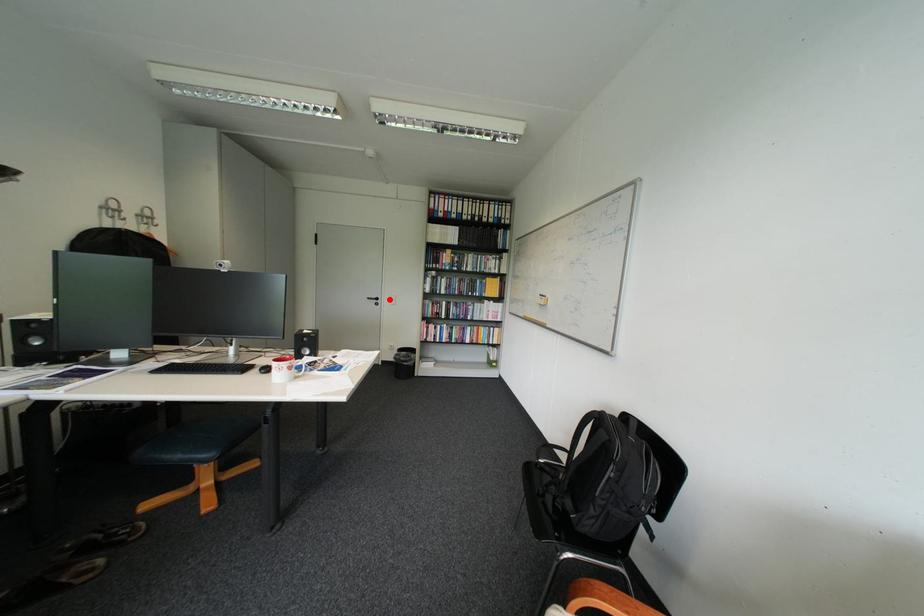
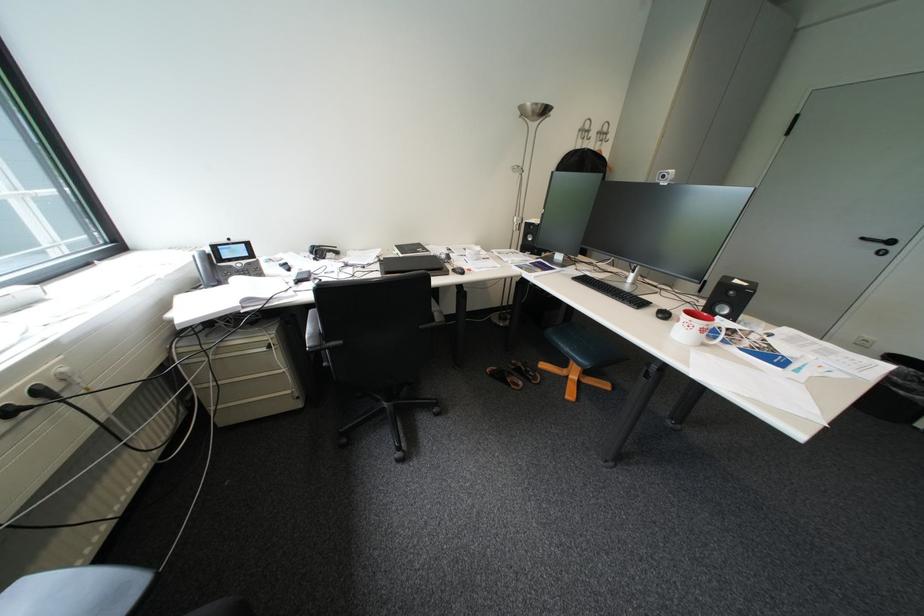
In the second image, find the point that corresponds to the highlighted location in the first image.

(904, 243)